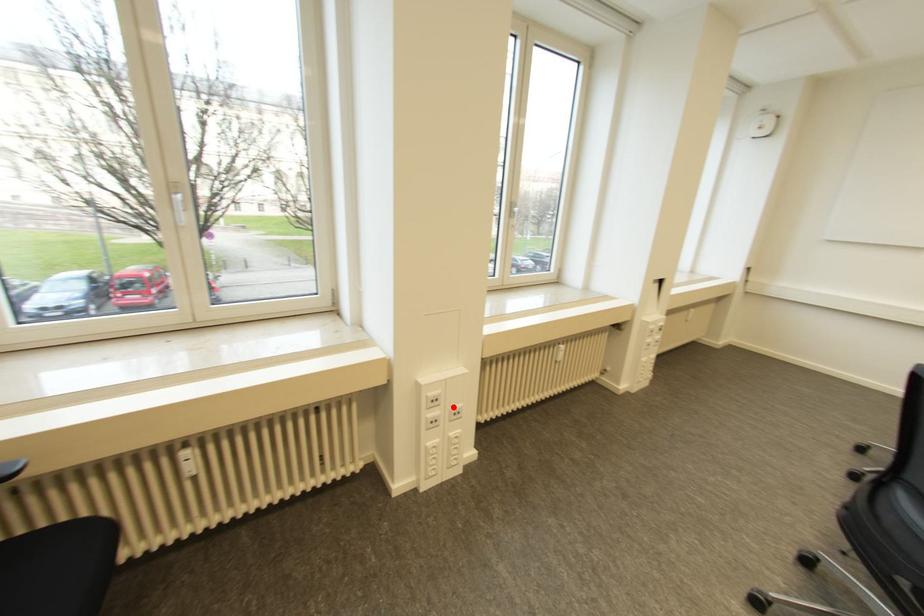
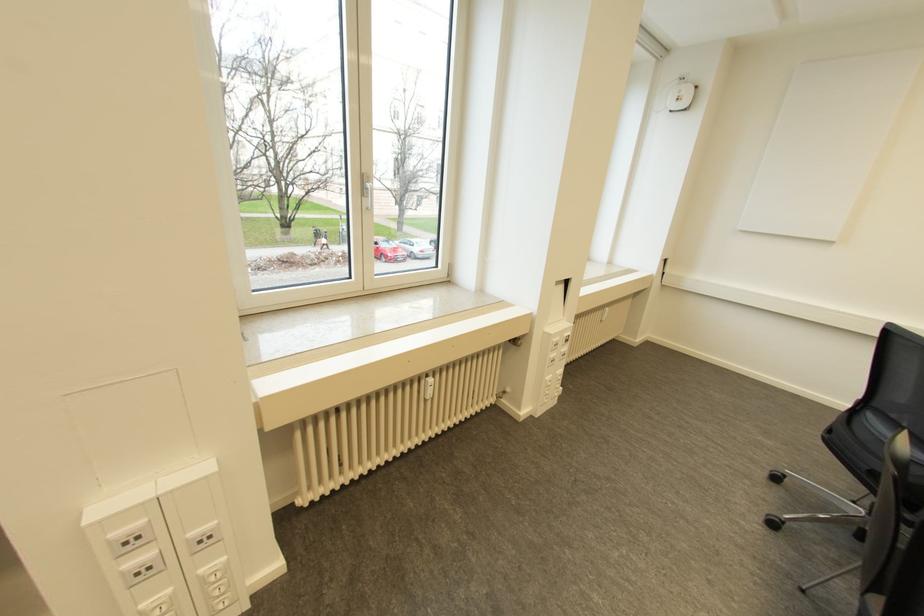
Where in the second image is the point corresponding to the highlighted location from the first image?

(197, 531)